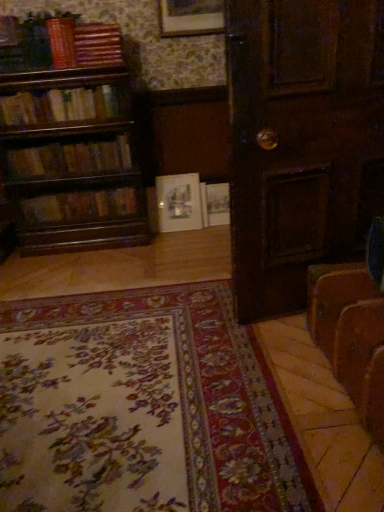
Question: From a real-world perspective, is white matte picture frame at center, positioned as the first picture frame in bottom-to-top order, positioned under floral carpet at lower center based on gravity?

Choices:
 (A) no
 (B) yes

Answer: (A)

Question: Is white matte picture frame at center, which is the first picture frame in back-to-front order, completely or partially outside of floral carpet at lower center?

Choices:
 (A) yes
 (B) no

Answer: (A)

Question: Is white matte picture frame at center, which is counted as the 2th picture frame, starting from the front, thinner than floral carpet at lower center?

Choices:
 (A) yes
 (B) no

Answer: (A)

Question: From a real-world perspective, is white matte picture frame at center, which is counted as the 2th picture frame, starting from the front, on top of floral carpet at lower center?

Choices:
 (A) yes
 (B) no

Answer: (A)

Question: Considering the relative sizes of white matte picture frame at center, the second picture frame positioned from the top, and floral carpet at lower center in the image provided, is white matte picture frame at center, the second picture frame positioned from the top, shorter than floral carpet at lower center?

Choices:
 (A) no
 (B) yes

Answer: (A)

Question: From the image's perspective, is white matte picture frame at center, which is the first picture frame in back-to-front order, located beneath floral carpet at lower center?

Choices:
 (A) no
 (B) yes

Answer: (A)

Question: Is wooden bookshelf at left, the fourth book ordered from the bottom, oriented towards white paper book at center, placed as the 2th book when sorted from bottom to top?

Choices:
 (A) no
 (B) yes

Answer: (A)

Question: Does wooden bookshelf at left, acting as the 3th book starting from the top, have a larger size compared to white paper book at center, placed as the 2th book when sorted from bottom to top?

Choices:
 (A) yes
 (B) no

Answer: (A)

Question: Does wooden bookshelf at left, the fourth book ordered from the bottom, appear on the right side of white paper book at center, placed as the 2th book when sorted from bottom to top?

Choices:
 (A) yes
 (B) no

Answer: (B)

Question: Would you say wooden bookshelf at left, acting as the 3th book starting from the top, contains white paper book at center, placed as the 2th book when sorted from bottom to top?

Choices:
 (A) yes
 (B) no

Answer: (B)

Question: Is wooden bookshelf at left, the fourth book ordered from the bottom, completely or partially outside of white paper book at center, placed as the 2th book when sorted from bottom to top?

Choices:
 (A) yes
 (B) no

Answer: (A)

Question: Is white paper book at center, the 5th book when ordered from top to bottom, at the back of wooden bookshelf at left, the fourth book ordered from the bottom?

Choices:
 (A) no
 (B) yes

Answer: (A)

Question: From the image's perspective, would you say wooden book at upper left, which is counted as the sixth book, starting from the bottom, is positioned over wooden book at upper left, acting as the 2th book starting from the top?

Choices:
 (A) yes
 (B) no

Answer: (A)